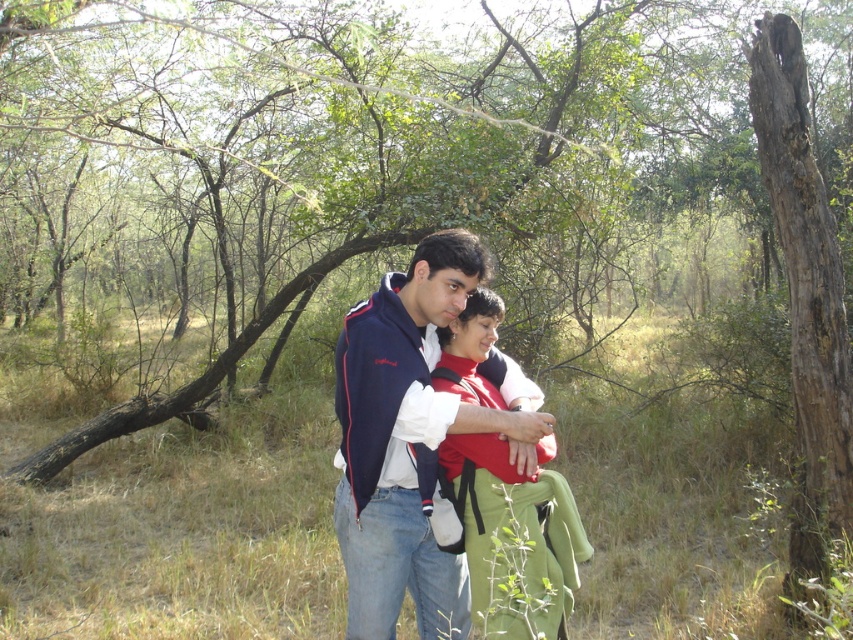
Who is higher up, matte blue jacket at center or red soft fabric baby at center?

Positioned higher is matte blue jacket at center.

Who is positioned more to the left, matte blue jacket at center or red soft fabric baby at center?

Positioned to the left is matte blue jacket at center.

Locate an element on the screen. This screenshot has height=640, width=853. matte blue jacket at center is located at coordinates (412, 438).